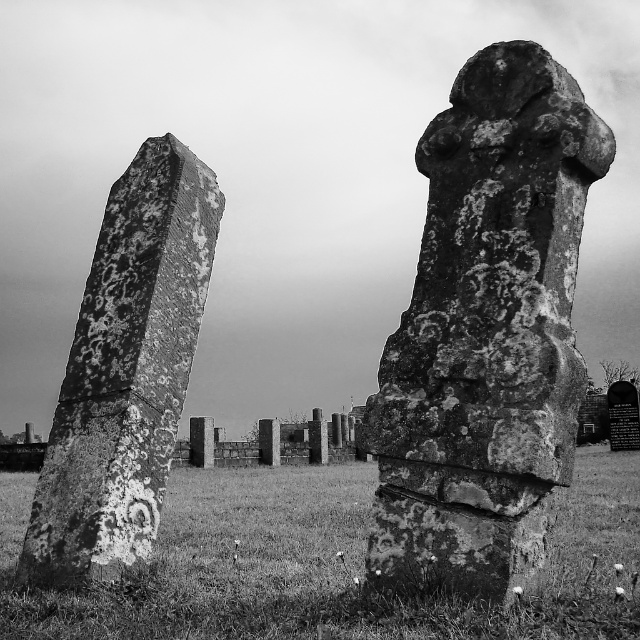
You are standing in the cemetery looking at the gravestones. There are two points marked in the image, one at coordinates point (449,232) and the other at point (100,593). Which of these points is nearer to you?

Point (449,232) is closer to the viewer than point (100,593).

You are standing in the cemetery and want to walk from point A to point B. Point A is at coordinate point [582,458] and point B is at coordinate point [36,524]. Which direction should you head to move from point A to point B?

Since point A is further to the viewer than point B, you should move forward towards the direction away from you to reach point B from point A.

You are a groundskeeper with a lawnmower that has a 4 foot wide cutting path. You need to mow the grass between the rough stone cross at center and the rusty stone gravestone at left. Can you safely mow between them without hitting either object?

The rough stone cross at center is 9.82 feet away from the rusty stone gravestone at left. Since the lawnmower has a 4 foot wide cutting path, there is enough space between them to safely mow without hitting either object.